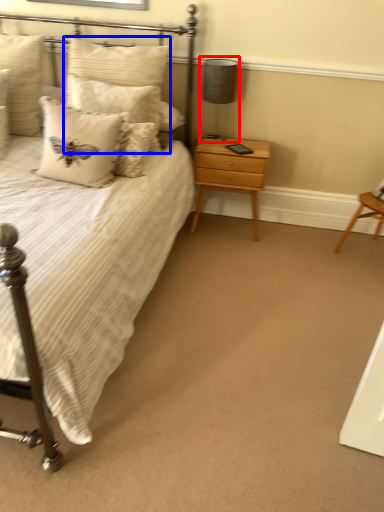
Question: Which object appears closest to the camera in this image, table lamp (highlighted by a red box) or pillow (highlighted by a blue box)?

Choices:
 (A) table lamp
 (B) pillow

Answer: (B)